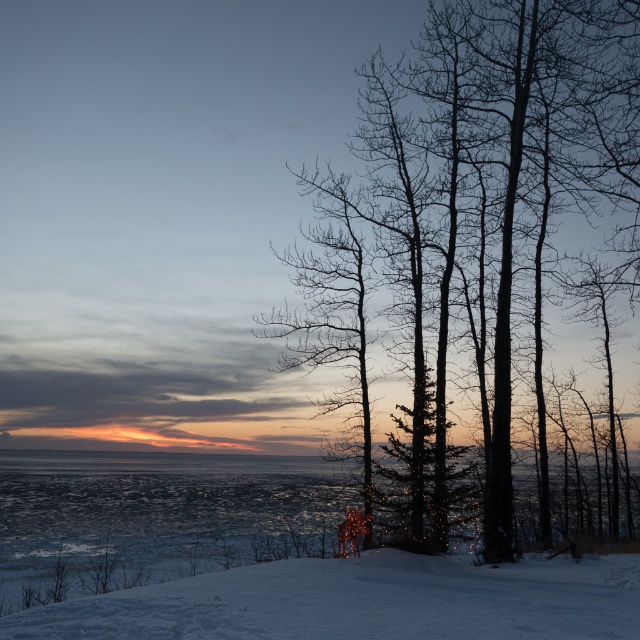
Question: Can you confirm if silhouette bare tree at right is positioned below white powdery snow at lower center?

Choices:
 (A) yes
 (B) no

Answer: (B)

Question: Which of the following is the closest to the observer?

Choices:
 (A) white powdery snow at lower center
 (B) silhouette bare tree at right

Answer: (A)

Question: Is silhouette bare tree at right positioned before white powdery snow at lower center?

Choices:
 (A) yes
 (B) no

Answer: (B)

Question: Does silhouette bare tree at right appear over white powdery snow at lower center?

Choices:
 (A) yes
 (B) no

Answer: (A)